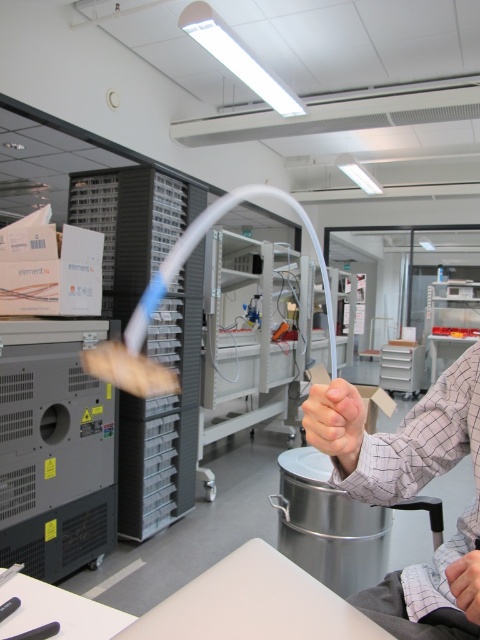
Who is shorter, transparent plastic tube at center or matte skin hand at center?

matte skin hand at center is shorter.

Looking at this image, is transparent plastic tube at center wider than matte skin hand at center?

No, transparent plastic tube at center is not wider than matte skin hand at center.

Which is in front, point (184, 240) or point (348, 403)?

Positioned in front is point (348, 403).

Locate an element on the screen. This screenshot has height=640, width=480. transparent plastic tube at center is located at coordinates (195, 244).

Is white matte table at lower center thinner than matte skin hand at center?

No.

Is point (362, 621) behind point (346, 465)?

No, (362, 621) is in front of (346, 465).

Locate an element on the screen. white matte table at lower center is located at coordinates (252, 604).

Is point (278, 570) farther from camera compared to point (469, 580)?

Yes, point (278, 570) is behind point (469, 580).

Who is more distant from viewer, (230, 595) or (471, 604)?

Positioned behind is point (230, 595).

The image size is (480, 640). What do you see at coordinates (252, 604) in the screenshot?
I see `white matte table at lower center` at bounding box center [252, 604].

Where is `white matte table at lower center`? white matte table at lower center is located at coordinates (252, 604).